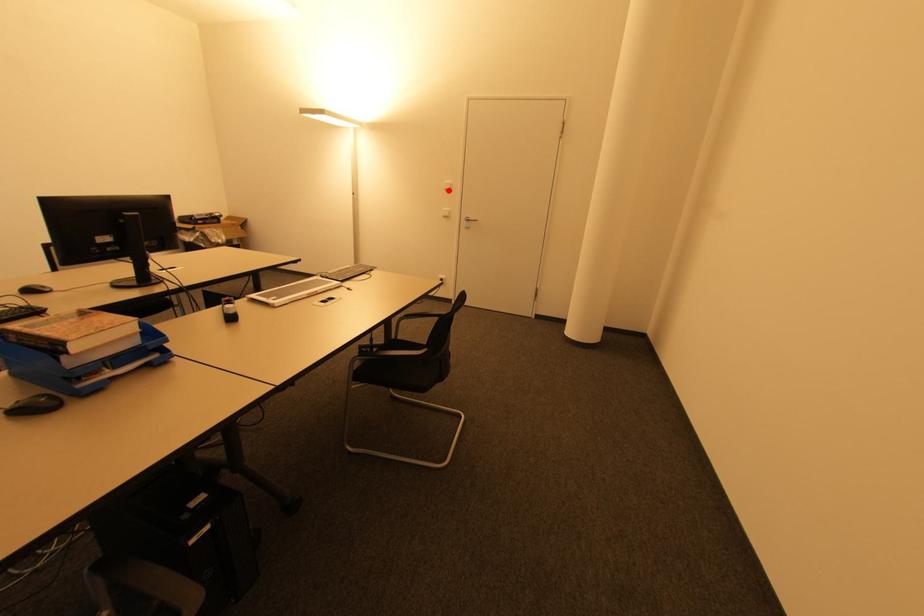
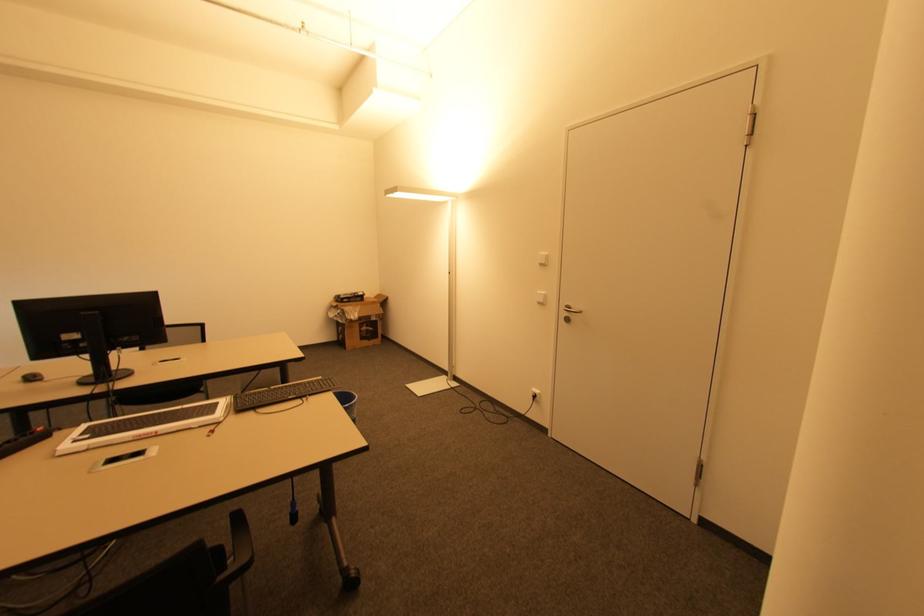
Question: I am providing you with two images of the same scene from different viewpoints. A red point is marked on the first image. Can you still see the location of the red point in image 2?

Choices:
 (A) Yes
 (B) No

Answer: (A)